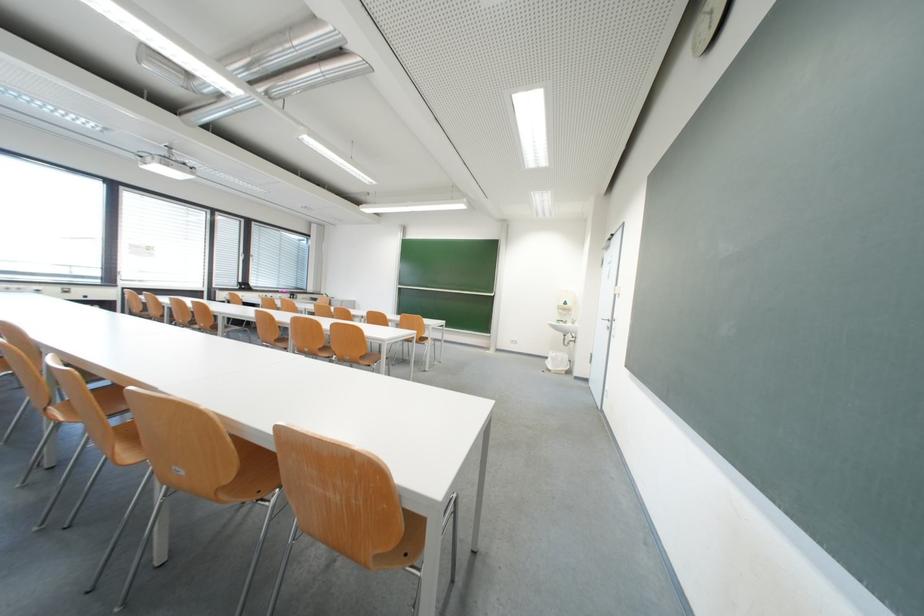
This screenshot has height=616, width=924. What do you see at coordinates (565, 331) in the screenshot?
I see `a blue dispenser lever` at bounding box center [565, 331].